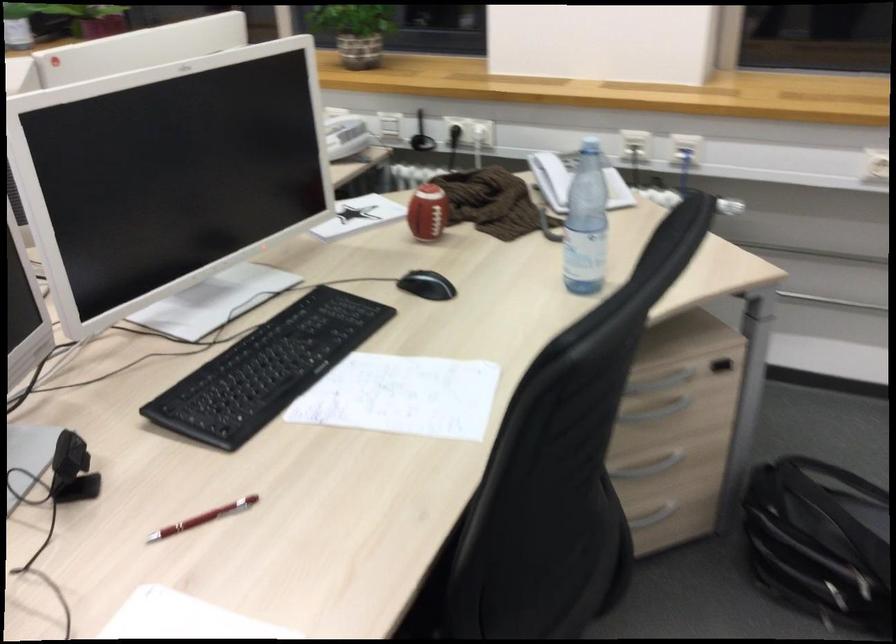
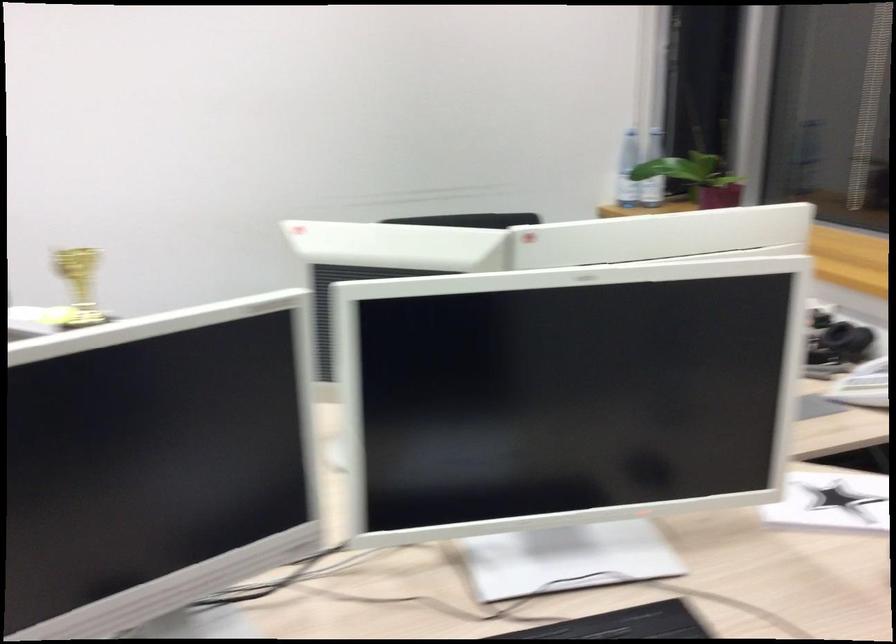
Question: The images are taken continuously from a first-person perspective. In which direction is your viewpoint rotating?

Choices:
 (A) Left
 (B) Right
 (C) Up
 (D) Down

Answer: (A)